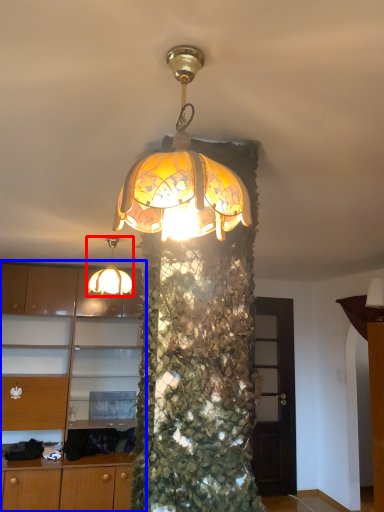
Question: Which object appears closest to the camera in this image, lamp (highlighted by a red box) or cabinetry (highlighted by a blue box)?

Choices:
 (A) lamp
 (B) cabinetry

Answer: (A)